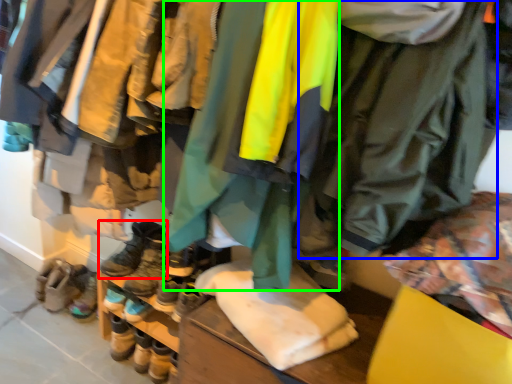
Question: Which object is the closest to the footwear (highlighted by a red box)? Choose among these: jacket (highlighted by a blue box) or jacket (highlighted by a green box).

Choices:
 (A) jacket
 (B) jacket

Answer: (B)